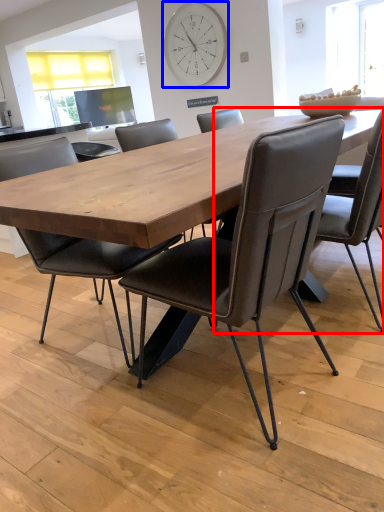
Question: Which object is closer to the camera taking this photo, chair (highlighted by a red box) or clock (highlighted by a blue box)?

Choices:
 (A) chair
 (B) clock

Answer: (A)